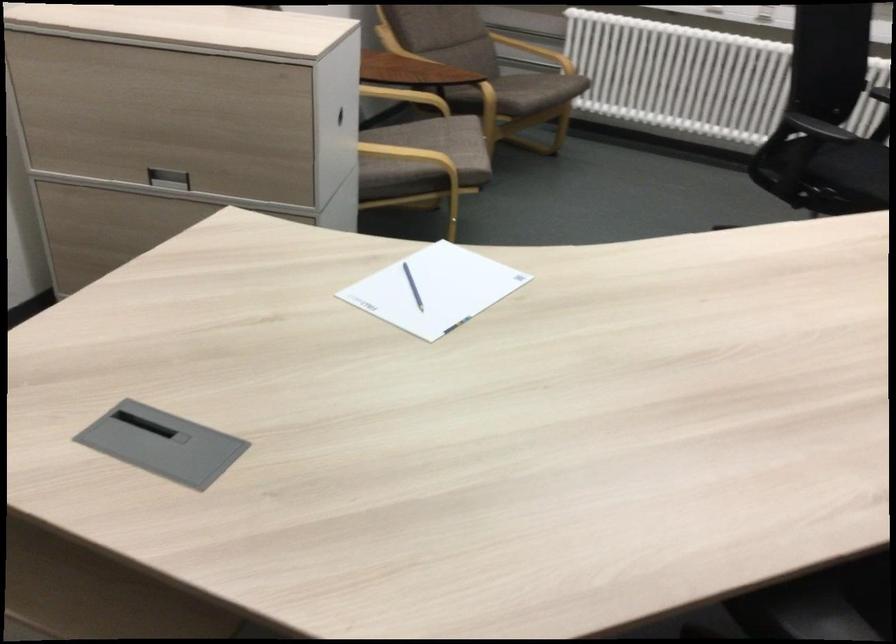
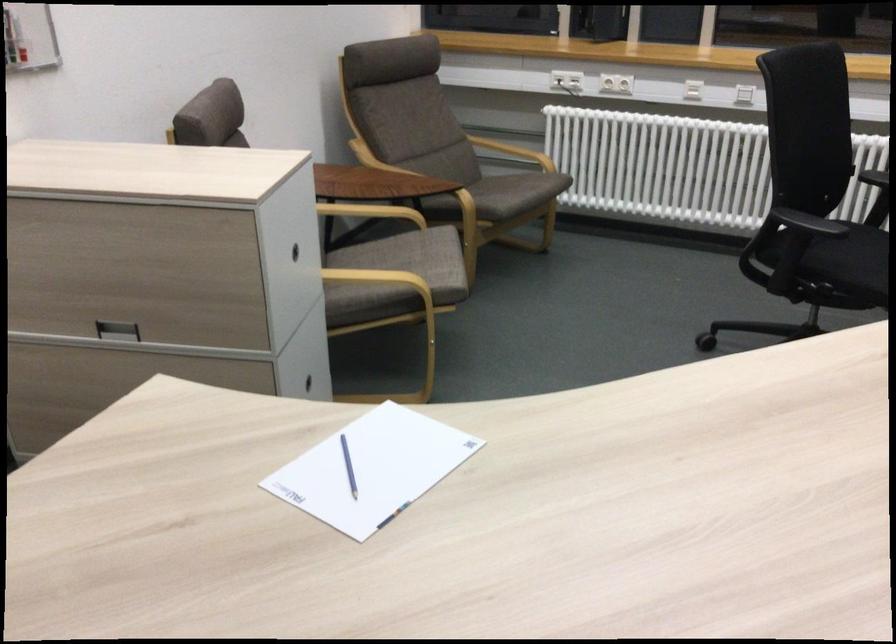
Where in the second image is the point corresponding to point (531, 89) from the first image?

(510, 191)